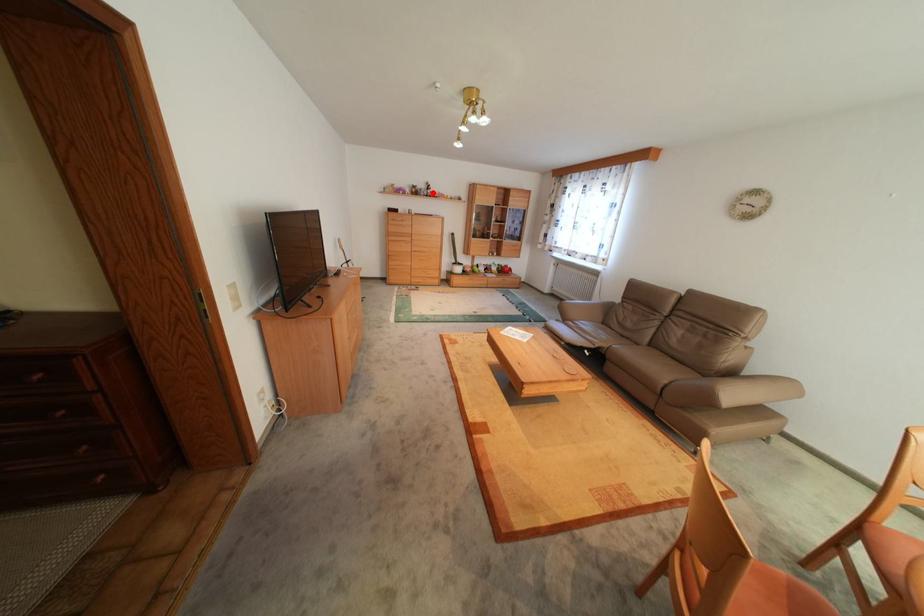
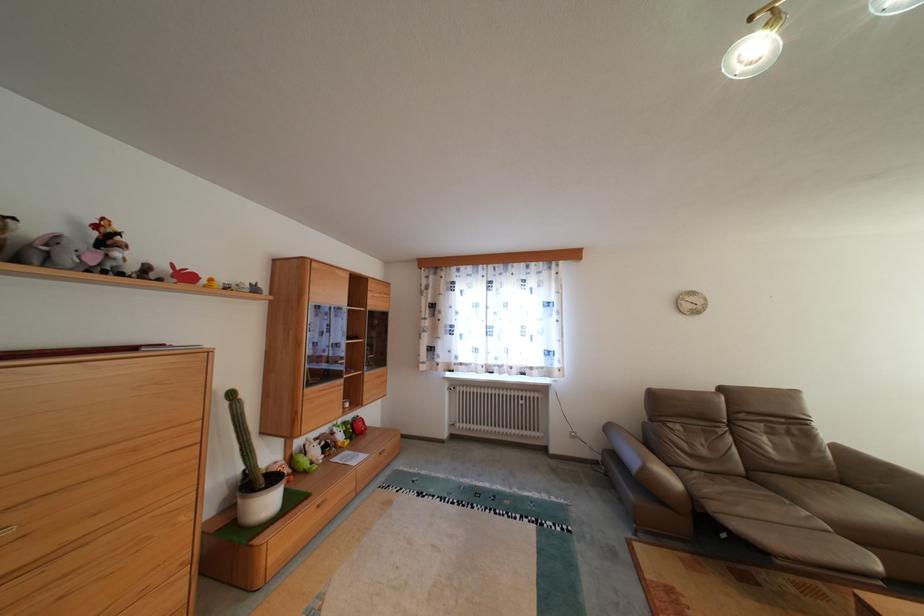
Question: I am providing you with two images of the same scene from different viewpoints. In image1, a red point is highlighted. Considering the same 3D point in image2, which of the following is correct?

Choices:
 (A) It is closer
 (B) It is farther

Answer: (B)